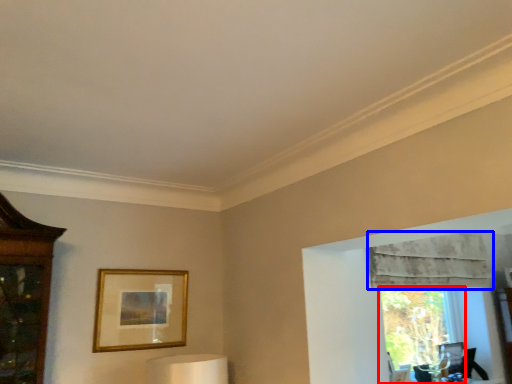
Question: Which object is closer to the camera taking this photo, window (highlighted by a red box) or curtain (highlighted by a blue box)?

Choices:
 (A) window
 (B) curtain

Answer: (B)